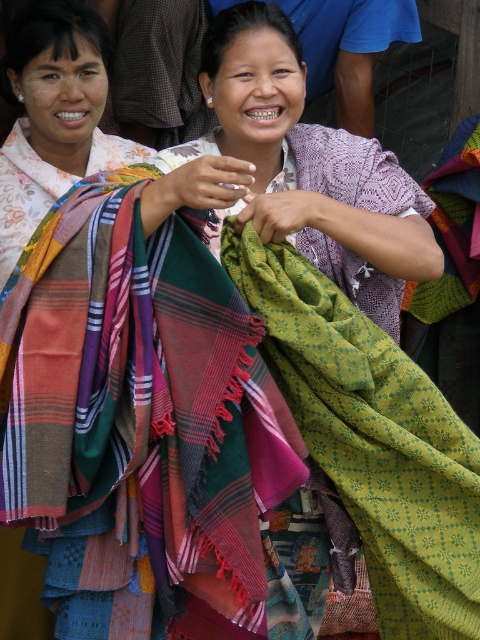
You are a customer at a market stall and see the green woven shawl at center and the plaid fabric scarf at center displayed by the vendor. Which item is closer to you?

The green woven shawl at center is closer to you because the plaid fabric scarf at center is behind it.

You are a customer at a market stall and see the green woven shawl at center and the plaid fabric scarf at center displayed by the vendor. Which one is positioned more to the right side?

The green woven shawl at center is positioned more to the right side than the plaid fabric scarf at center.